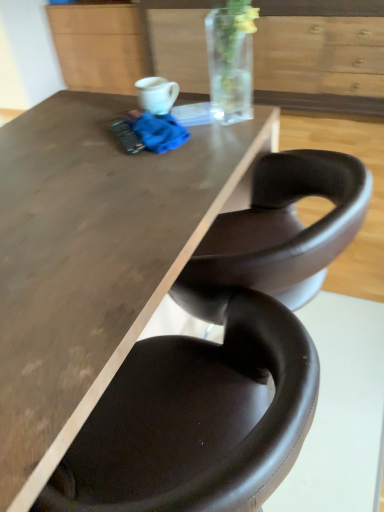
Where is `vacant region to the left of white glossy mug at upper center`? This screenshot has height=512, width=384. vacant region to the left of white glossy mug at upper center is located at coordinates (92, 125).